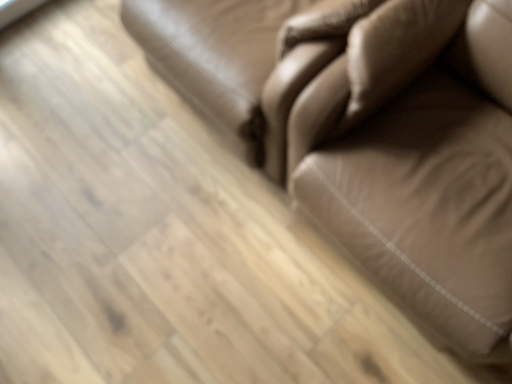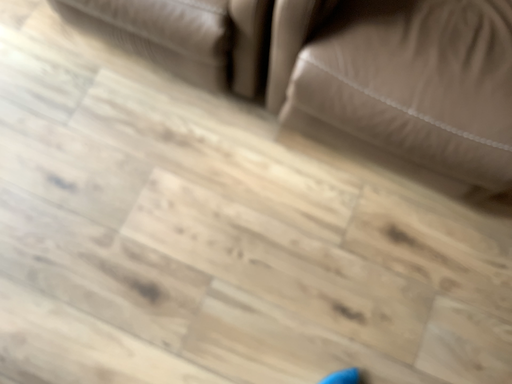
Question: Which way did the camera rotate in the video?

Choices:
 (A) rotated downward
 (B) rotated upward

Answer: (A)